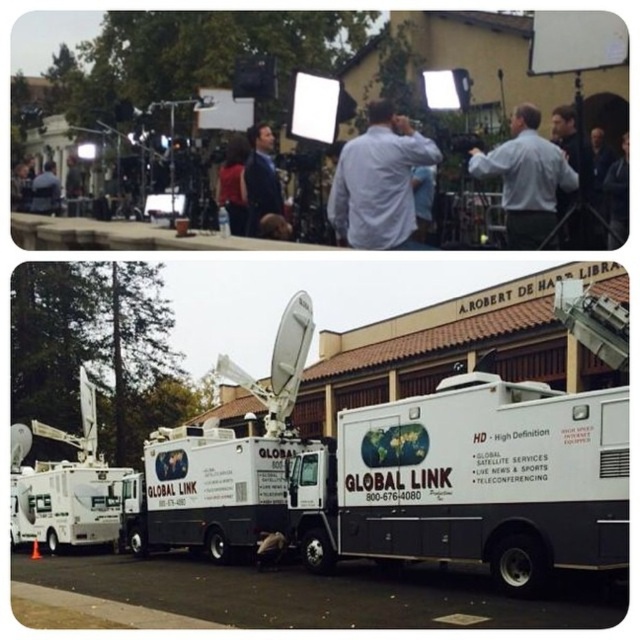
You are a technician who needs to move a 10 meter long cable from the white shirt at center to the dark blue suit at center. Can you connect them without extending the cable?

The white shirt at center and dark blue suit at center are 11.25 meters apart. The cable is only 10 meters long, so it is not long enough to connect them without extending.

You are a costume assistant at the media event and need to locate the dark blue suit at center and the dark blue jacket at upper right. Based on their positions, which one is closer to the left side of the top section?

The dark blue suit at center is to the left of dark blue jacket at upper right, so the dark blue suit at center is closer to the left side of the top section.